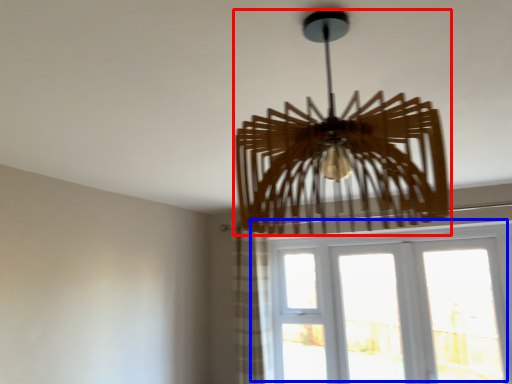
Question: Among these objects, which one is nearest to the camera, lamp (highlighted by a red box) or window (highlighted by a blue box)?

Choices:
 (A) lamp
 (B) window

Answer: (A)